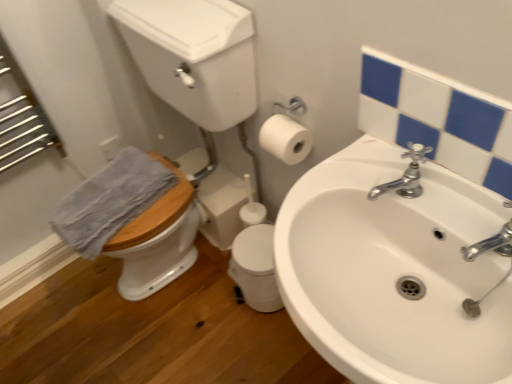
This screenshot has width=512, height=384. What are the coordinates of `vacant space behind silver metallic faucet at upper right` in the screenshot? It's located at (370, 172).